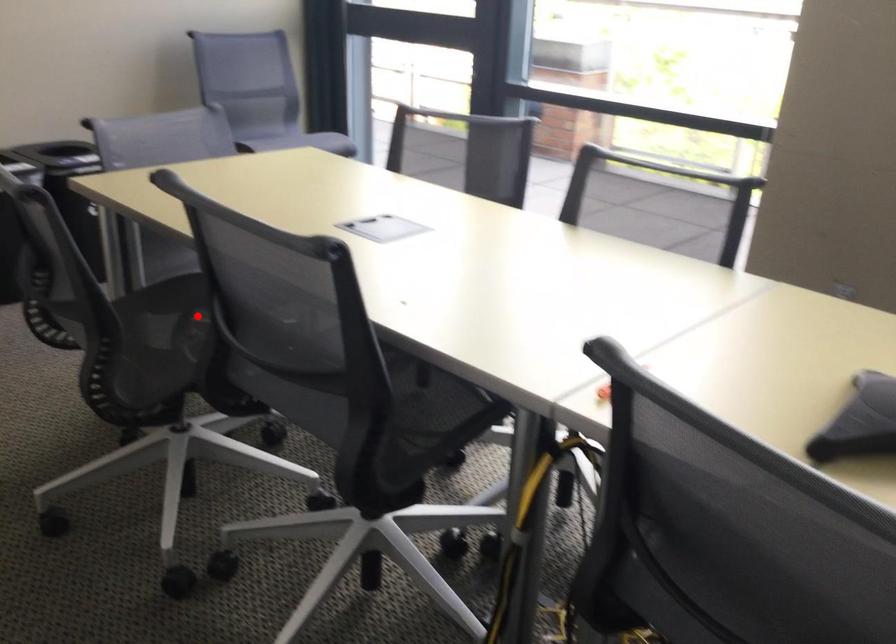
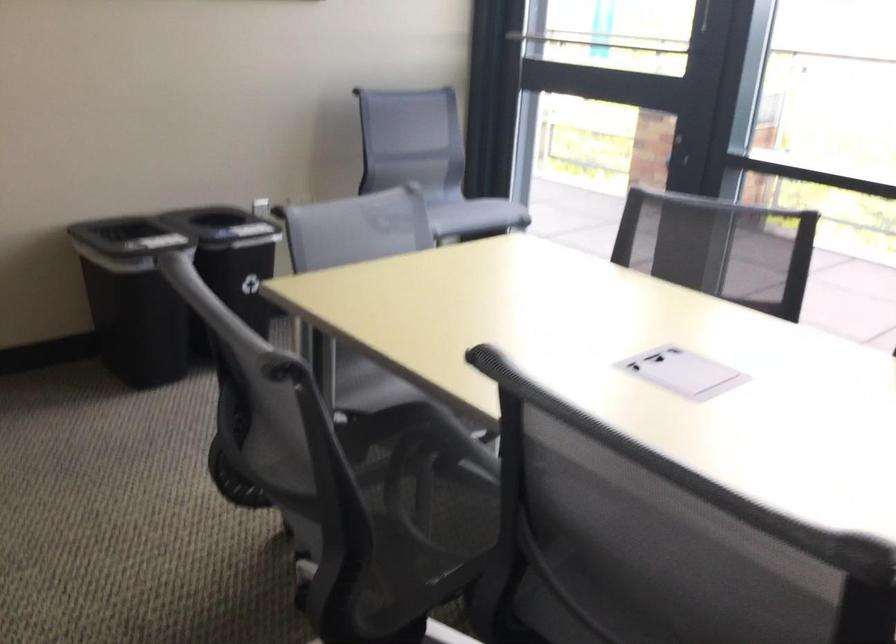
Question: A red point is marked in image1. In image2, is the corresponding 3D point closer to the camera or farther? Reply with the corresponding letter.

Choices:
 (A) The corresponding 3D point is closer.
 (B) The corresponding 3D point is farther.

Answer: (A)